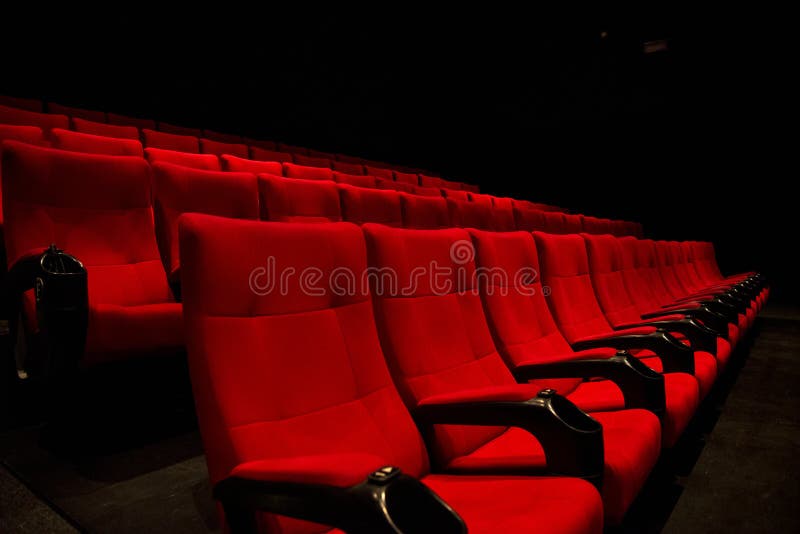
Find the location of a particular element. Image resolution: width=800 pixels, height=534 pixels. floor is located at coordinates (706, 496), (778, 384), (138, 499), (30, 499).